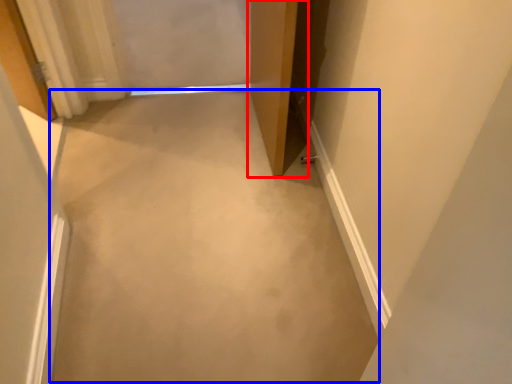
Question: Which object is further to the camera taking this photo, door (highlighted by a red box) or concrete (highlighted by a blue box)?

Choices:
 (A) door
 (B) concrete

Answer: (A)